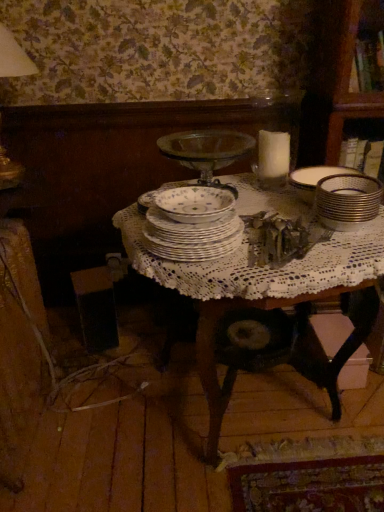
Where is `free space above porcelain plates at center (from a real-world perspective)`? Image resolution: width=384 pixels, height=512 pixels. free space above porcelain plates at center (from a real-world perspective) is located at coordinates (198, 208).